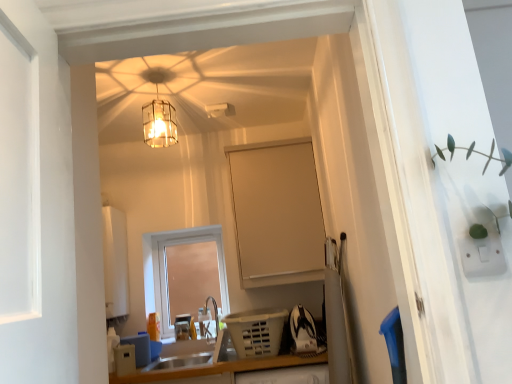
Question: Is satin silver sink at lower center at the back of matte white window at center?

Choices:
 (A) no
 (B) yes

Answer: (A)

Question: From a real-world perspective, is matte white window at center under satin silver sink at lower center?

Choices:
 (A) yes
 (B) no

Answer: (B)

Question: Is there a large distance between matte white window at center and satin silver sink at lower center?

Choices:
 (A) yes
 (B) no

Answer: (B)

Question: Does matte white window at center have a lesser height compared to satin silver sink at lower center?

Choices:
 (A) yes
 (B) no

Answer: (B)

Question: From the image's perspective, is matte white window at center located above satin silver sink at lower center?

Choices:
 (A) no
 (B) yes

Answer: (B)

Question: Is matte white window at center taller or shorter than beige matte cabinet at center?

Choices:
 (A) tall
 (B) short

Answer: (B)

Question: From a real-world perspective, relative to beige matte cabinet at center, is matte white window at center vertically above or below?

Choices:
 (A) below
 (B) above

Answer: (A)

Question: Relative to beige matte cabinet at center, is matte white window at center in front or behind?

Choices:
 (A) behind
 (B) front

Answer: (A)

Question: In terms of width, does matte white window at center look wider or thinner when compared to beige matte cabinet at center?

Choices:
 (A) thin
 (B) wide

Answer: (A)

Question: Considering the positions of white plastic laundry basket at lower center, which is the second appliance in left-to-right order, and beige matte cabinet at center in the image, is white plastic laundry basket at lower center, which is the second appliance in left-to-right order, bigger or smaller than beige matte cabinet at center?

Choices:
 (A) big
 (B) small

Answer: (B)

Question: In the image, is white plastic laundry basket at lower center, which is the second appliance in left-to-right order, on the left side or the right side of beige matte cabinet at center?

Choices:
 (A) left
 (B) right

Answer: (A)

Question: From the image's perspective, relative to beige matte cabinet at center, is white plastic laundry basket at lower center, the first appliance in the right-to-left sequence, above or below?

Choices:
 (A) above
 (B) below

Answer: (B)

Question: Is point (265, 352) closer or farther from the camera than point (286, 216)?

Choices:
 (A) closer
 (B) farther

Answer: (A)

Question: Considering the positions of beige matte cabinet at center and satin silver sink at lower center in the image, is beige matte cabinet at center wider or thinner than satin silver sink at lower center?

Choices:
 (A) thin
 (B) wide

Answer: (A)

Question: From a real-world perspective, relative to satin silver sink at lower center, is beige matte cabinet at center vertically above or below?

Choices:
 (A) above
 (B) below

Answer: (A)